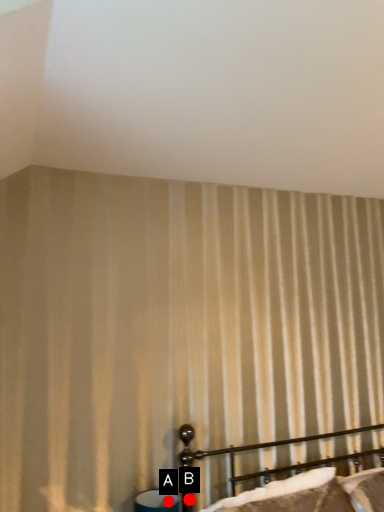
Question: Two points are circled on the image, labeled by A and B beside each circle. Which point is closer to the camera taking this photo?

Choices:
 (A) A is closer
 (B) B is closer

Answer: (A)